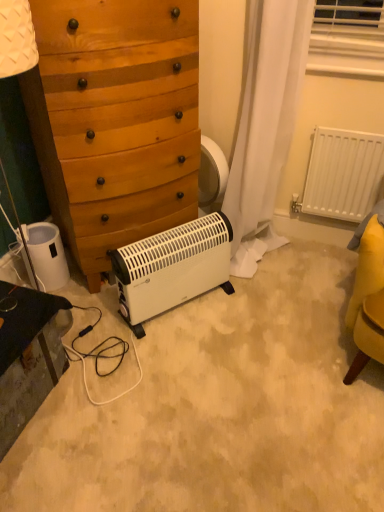
Locate an element on the screen. The image size is (384, 512). vacant space that is in between white matte heater at center and black glossy vanity at lower left is located at coordinates (108, 371).